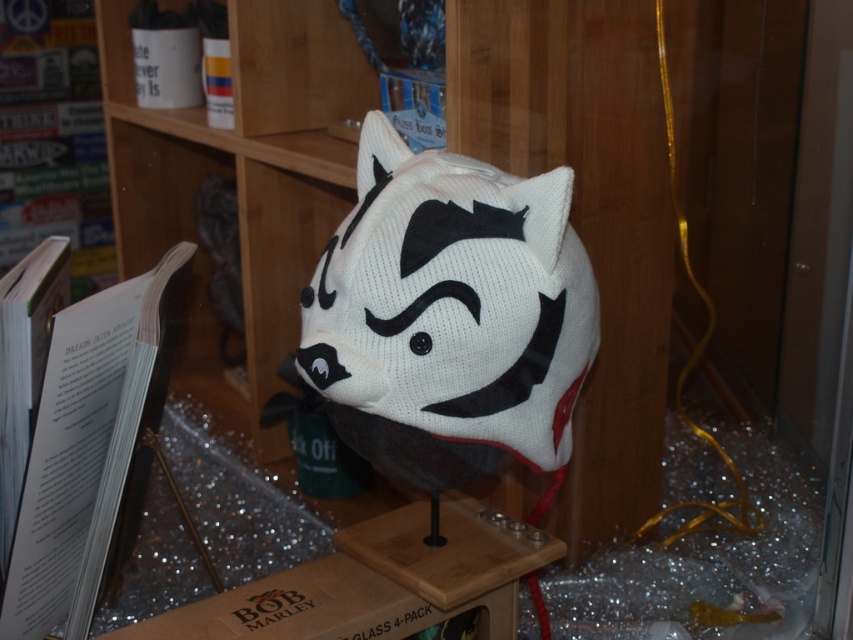
You are an interior designer assessing the display case. You need to ensure that the white knitted hat at center can be placed on the wooden bookshelf at center. Based on their widths, will the hat fit on the shelf?

The wooden bookshelf at center has a greater width than the white knitted hat at center, so the hat will fit on the shelf.

You are standing in front of a display case and want to reach the white knitted hat at center. The wooden bookshelf at center is in your way. Can you move around it to get closer to the hat?

The wooden bookshelf at center is further to the viewer than white knitted hat at center, so you can move around it to get closer to the hat.

From the picture: You are a delivery person who needs to place a large package that is 1 meter wide. You see the wooden bookshelf at center and a camera in the scene. Can you fit the package between them?

The wooden bookshelf at center and camera are 95.19 centimeters apart. Since the package is 1 meter wide, which is 100 centimeters, it cannot fit between them as the space is narrower than the package.